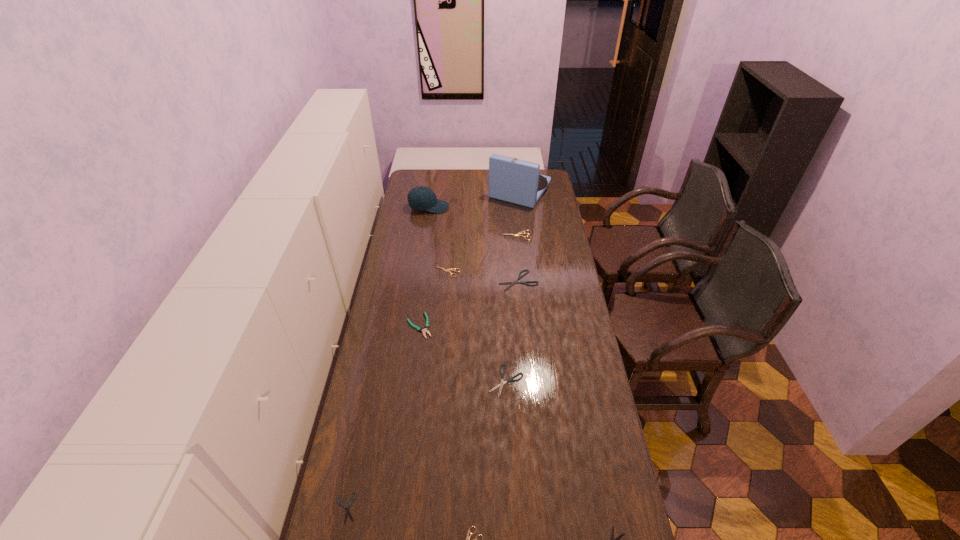
Identify which beige shears is the second closest to the sixth shears from right to left. Please provide its 2D coordinates. Your answer should be formatted as a tuple, i.e. [(x, y)], where the tuple contains the x and y coordinates of a point satisfying the conditions above.

[(468, 537)]

Find the location of a particular element. The width and height of the screenshot is (960, 540). beige shears that stands as the closest to the nearest beige shears is located at coordinates (451, 269).

Locate an element on the screen. The width and height of the screenshot is (960, 540). the second closest black shears to the teal pliers is located at coordinates (512, 283).

Identify which black shears is located as the fourth nearest to the blue phonograph record. Please provide its 2D coordinates. Your answer should be formatted as a tuple, i.e. [(x, y)], where the tuple contains the x and y coordinates of a point satisfying the conditions above.

[(612, 535)]

This screenshot has width=960, height=540. Identify the location of vacant space that satisfies the following two spatial constraints: 1. on the front-facing side of the second tallest object; 2. on the right side of the biggest black shears. (418, 280).